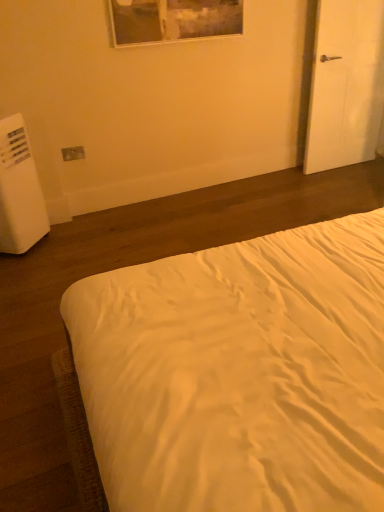
This screenshot has height=512, width=384. In order to click on free space to the right of white plastic water heater at left in this screenshot , I will do `click(82, 232)`.